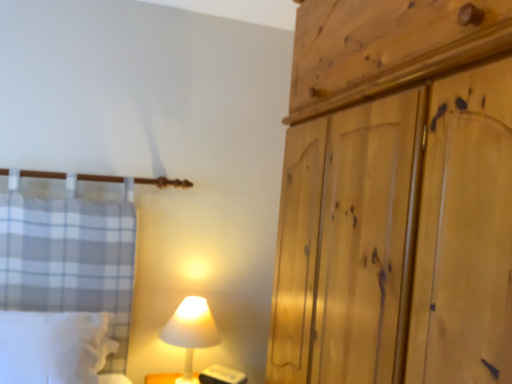
Question: Is white matte lamp at lower center outside of natural wood wardrobe at right?

Choices:
 (A) no
 (B) yes

Answer: (B)

Question: From a real-world perspective, is white matte lamp at lower center located higher than natural wood wardrobe at right?

Choices:
 (A) yes
 (B) no

Answer: (B)

Question: Is white matte lamp at lower center at the right side of natural wood wardrobe at right?

Choices:
 (A) no
 (B) yes

Answer: (A)

Question: Is white matte lamp at lower center wider than natural wood wardrobe at right?

Choices:
 (A) yes
 (B) no

Answer: (B)

Question: Does white matte lamp at lower center have a lesser width compared to natural wood wardrobe at right?

Choices:
 (A) no
 (B) yes

Answer: (B)

Question: Considering the positions of point (22, 349) and point (194, 309), is point (22, 349) closer or farther from the camera than point (194, 309)?

Choices:
 (A) farther
 (B) closer

Answer: (B)

Question: Considering their positions, is white soft pillow at lower left located in front of or behind white matte lamp at lower center?

Choices:
 (A) behind
 (B) front

Answer: (B)

Question: From a real-world perspective, is white soft pillow at lower left above or below white matte lamp at lower center?

Choices:
 (A) above
 (B) below

Answer: (A)

Question: Do you think white soft pillow at lower left is within white matte lamp at lower center, or outside of it?

Choices:
 (A) inside
 (B) outside

Answer: (B)

Question: Choose the correct answer: Is natural wood wardrobe at right inside white matte lamp at lower center or outside it?

Choices:
 (A) inside
 (B) outside

Answer: (B)

Question: Is natural wood wardrobe at right wider or thinner than white matte lamp at lower center?

Choices:
 (A) wide
 (B) thin

Answer: (A)

Question: Would you say natural wood wardrobe at right is to the left or to the right of white matte lamp at lower center in the picture?

Choices:
 (A) right
 (B) left

Answer: (A)

Question: Considering their positions, is natural wood wardrobe at right located in front of or behind white matte lamp at lower center?

Choices:
 (A) behind
 (B) front

Answer: (B)

Question: Is point (198, 329) closer or farther from the camera than point (80, 367)?

Choices:
 (A) closer
 (B) farther

Answer: (B)

Question: Is white matte lamp at lower center spatially inside white soft pillow at lower left, or outside of it?

Choices:
 (A) outside
 (B) inside

Answer: (A)